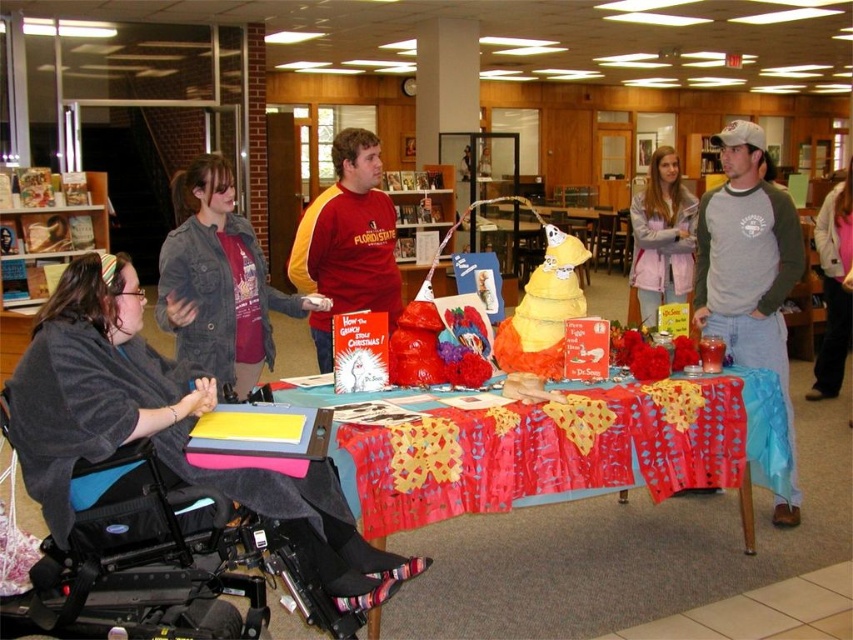
You are organizing a community event and need to place a 1.2 meter long banner on the table. The banner must be placed on the table surface. Can the red fabric tablecloth at center and the cardboard box at center accommodate the banner without overlapping?

The red fabric tablecloth at center is shorter than the cardboard box at center. Since the banner requires 1.2 meters of space, and the tablecloth is shorter than the box, the banner may not fit properly. The cardboard box at center might be taller but not necessarily wider. Without knowing the exact dimensions of the table surface or the objects, it is uncertain if the banner can be placed without overlapping. However, since the tablecloth is shorter than the box, it might leave less space on the table. It

You are standing at the origin point in the image. Which direction should you move to reach the red matte shirt at center?

The red matte shirt at center is located at point (x=347, y=241), so you should move northeast to reach it.